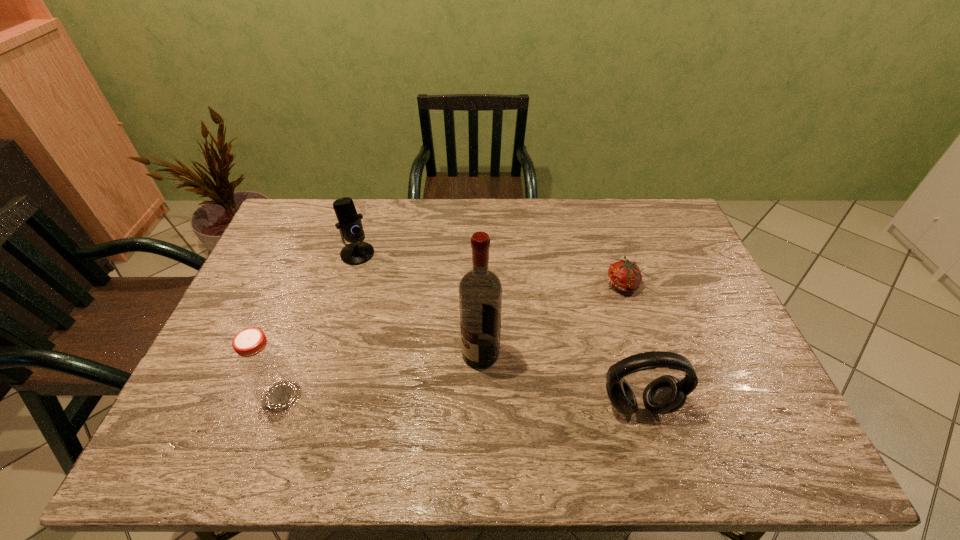
In order to click on vacant space on the desktop that is between the bottle and the headset and is positioned on the stand of the microphone in this screenshot , I will do `click(426, 400)`.

Image resolution: width=960 pixels, height=540 pixels. Find the location of `free spot on the desktop that is between the bottle and the headset and is positioned on the front-facing side of the shortest object`. free spot on the desktop that is between the bottle and the headset and is positioned on the front-facing side of the shortest object is located at coordinates (507, 402).

Identify the location of vacant spot on the desktop that is between the bottle and the headset and is positioned on the front and back of the alcohol. click(x=415, y=400).